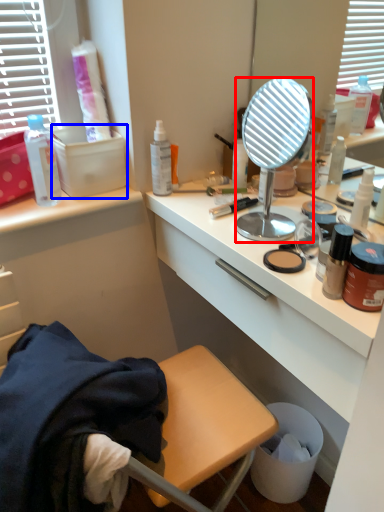
Question: Which of the following is the closest to the observer, mirror (highlighted by a red box) or box (highlighted by a blue box)?

Choices:
 (A) mirror
 (B) box

Answer: (A)